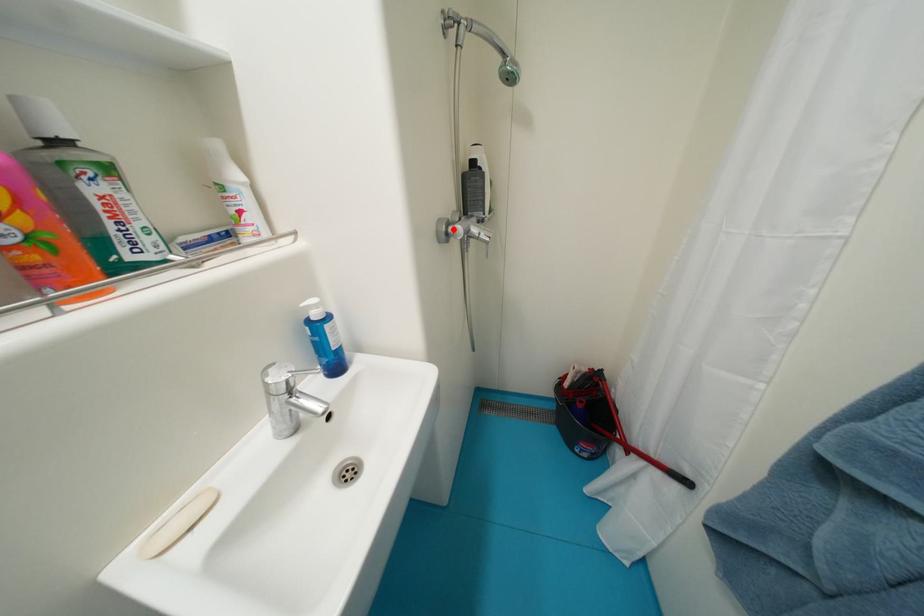
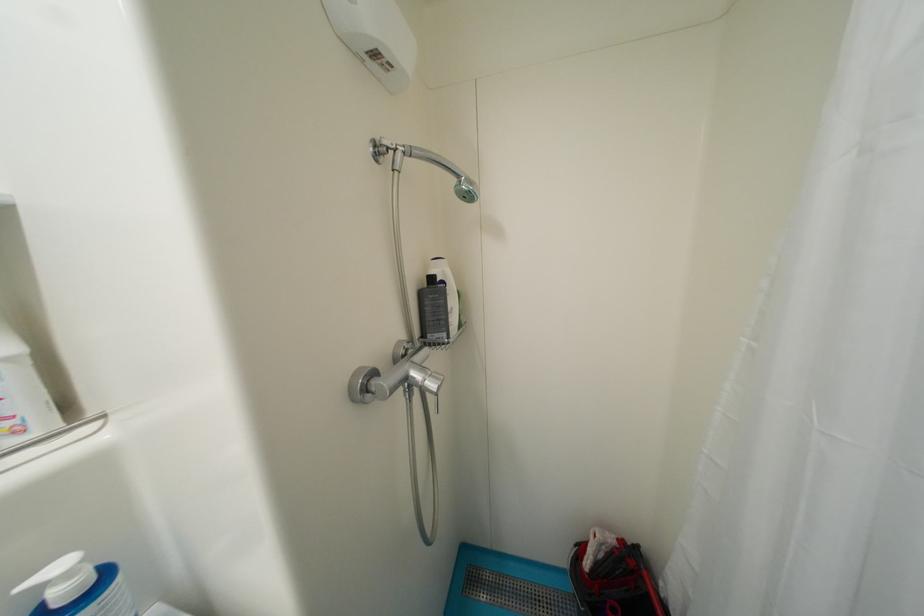
The point at the highlighted location is marked in the first image. Where is the corresponding point in the second image?

(374, 383)